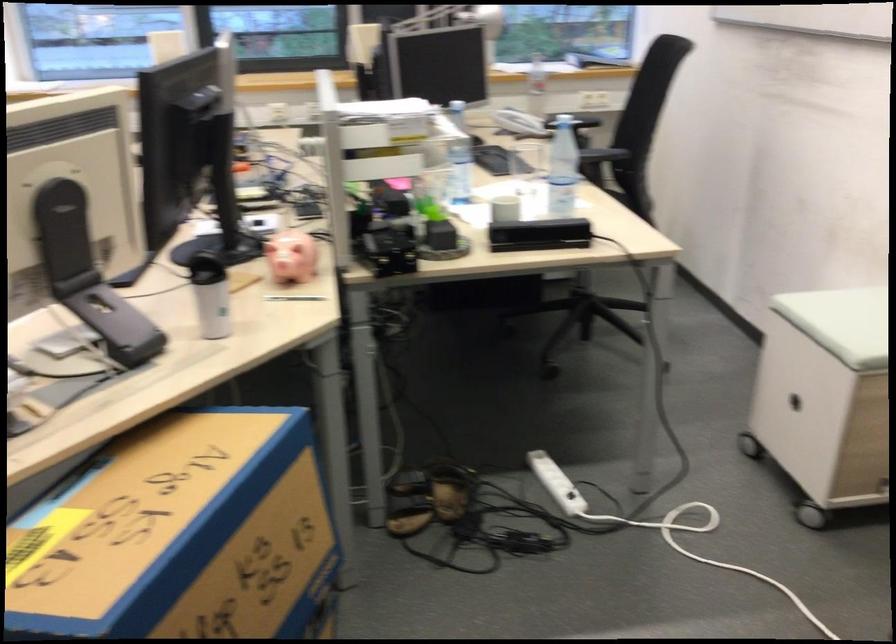
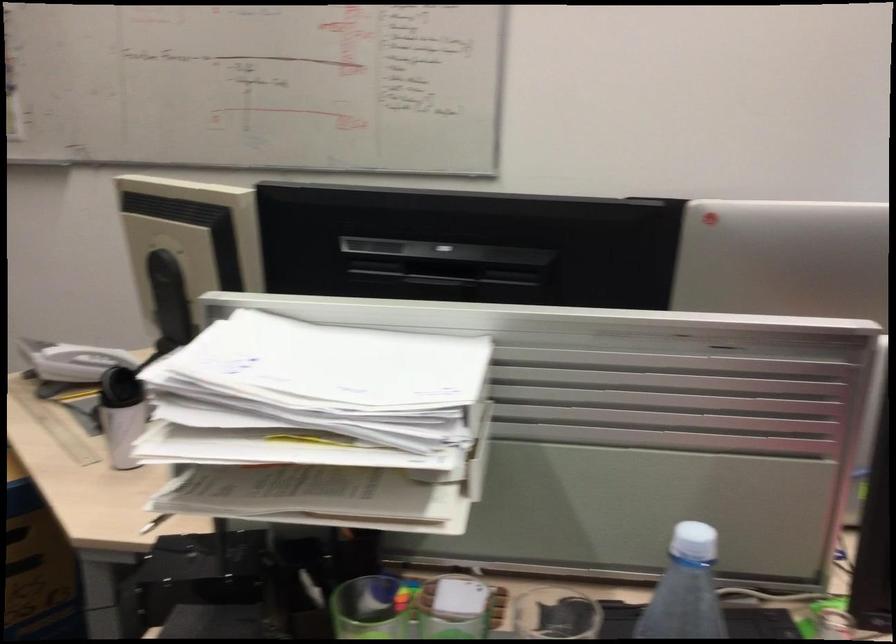
Question: I am providing you with two images of the same scene from different viewpoints. Which of the following objects are not visible in image2?

Choices:
 (A) printer start button
 (B) pink piggy bank
 (C) green pen holder
 (D) white telephone handset

Answer: (B)